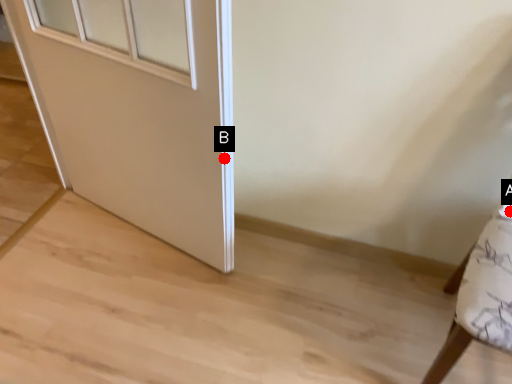
Question: Two points are circled on the image, labeled by A and B beside each circle. Which point is further to the camera?

Choices:
 (A) A is further
 (B) B is further

Answer: (B)